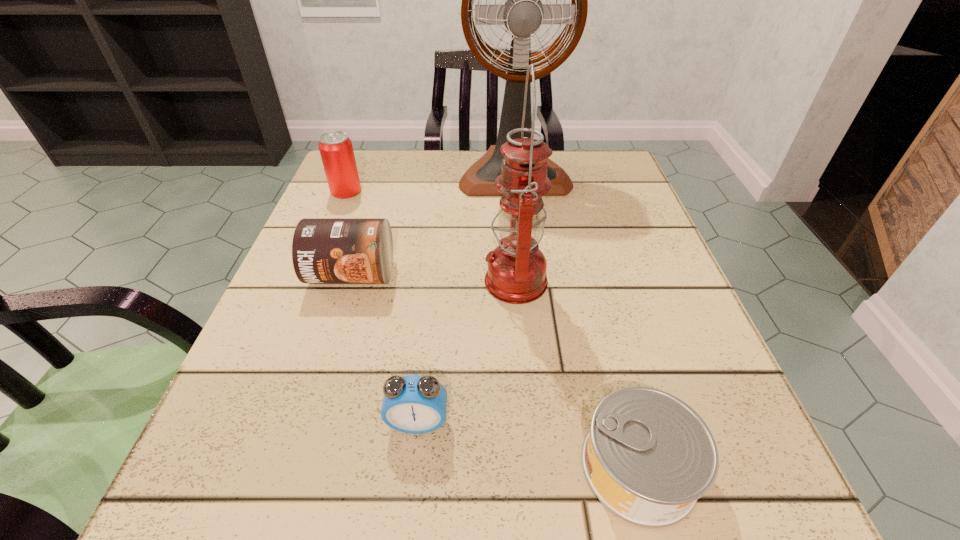
I want to click on empty space between the shortest can and the second tallest object, so click(577, 374).

You are a GUI agent. You are given a task and a screenshot of the screen. Output one action in this format:
    pyautogui.click(x=<x>, y=<y>)
    Task: Click on the free space that is in between the oil lamp and the third tallest object
    
    Given the screenshot: What is the action you would take?
    pyautogui.click(x=431, y=236)

Locate an element on the screen. free spot between the second tallest object and the fourth tallest object is located at coordinates (434, 278).

Where is `vacant area that lies between the second nearest can and the tallest object`? This screenshot has width=960, height=540. vacant area that lies between the second nearest can and the tallest object is located at coordinates (433, 223).

Find the location of a particular element. free area in between the second tallest can and the second shortest object is located at coordinates (385, 348).

Identify the location of empty location between the second shortest can and the fan. Image resolution: width=960 pixels, height=540 pixels. (433, 223).

Locate an element on the screen. unoccupied area between the alarm clock and the fourth shortest object is located at coordinates (382, 307).

Image resolution: width=960 pixels, height=540 pixels. Find the location of `free point between the oil lamp and the shortest object`. free point between the oil lamp and the shortest object is located at coordinates [x=577, y=374].

Identify which object is the fourth nearest to the second farthest can. Please provide its 2D coordinates. Your answer should be formatted as a tuple, i.e. [(x, y)], where the tuple contains the x and y coordinates of a point satisfying the conditions above.

[(523, 13)]

Point out which object is positioned as the fifth nearest to the shortest object. Please provide its 2D coordinates. Your answer should be formatted as a tuple, i.e. [(x, y)], where the tuple contains the x and y coordinates of a point satisfying the conditions above.

[(336, 150)]